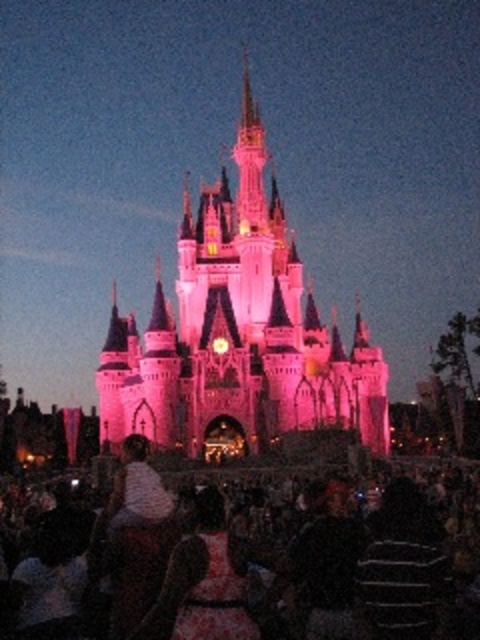
Does pink stone castle at center appear on the left side of matte pink dress at lower center?

Incorrect, pink stone castle at center is not on the left side of matte pink dress at lower center.

Is point (325, 330) less distant than point (464, 483)?

No, (325, 330) is behind (464, 483).

What do you see at coordinates (238, 333) in the screenshot? I see `pink stone castle at center` at bounding box center [238, 333].

Locate an element on the screen. Image resolution: width=480 pixels, height=640 pixels. pink stone castle at center is located at coordinates (238, 333).